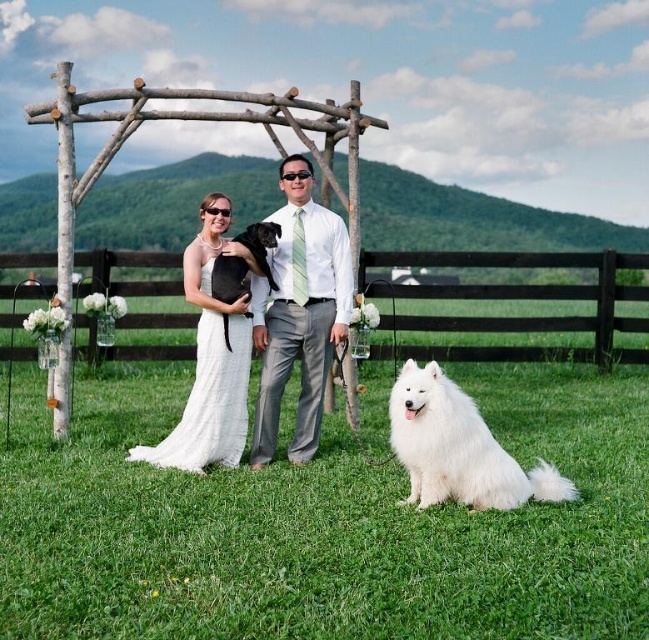
You are a photographer standing at the camera position. You want to place a decoration at point [606,296] which is 12.20 meters away from you. The decoration requires a flat surface. Is there any object at that point that can serve as a flat surface?

There is no object listed at point [606,296], so you can place the decoration there as it is on the flat ground.

You are a photographer at the wedding and need to capture a photo where both the white fluffy dog at lower right and the white satin dress at center are visible. Based on their positions, which object should you focus on first to ensure both are in frame?

The white fluffy dog at lower right is located below the white satin dress at center, so you should focus on the white satin dress at center first to ensure both are in frame.

You are a photographer at the wedding and need to frame the scene such that both the white fluffy dog at lower right and the white satin dress at center are visible. Given that your camera has a fixed focal length, which object should you prioritize keeping closer to the center of the frame to ensure both are in focus?

Since the white fluffy dog at lower right is wider than the white satin dress at center, you should prioritize keeping the white fluffy dog at lower right closer to the center of the frame to ensure both are in focus.